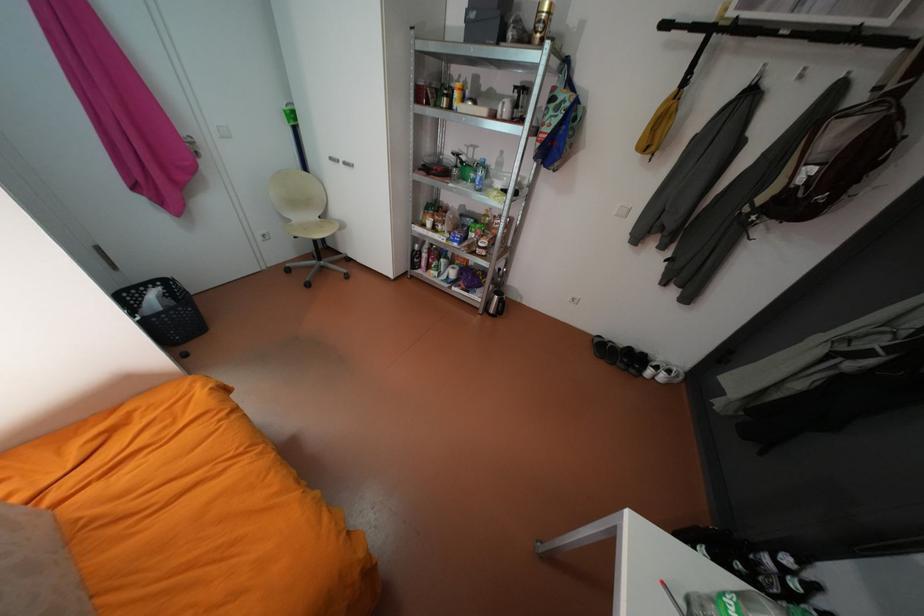
In order to click on chair sitting surface in this screenshot , I will do `click(312, 228)`.